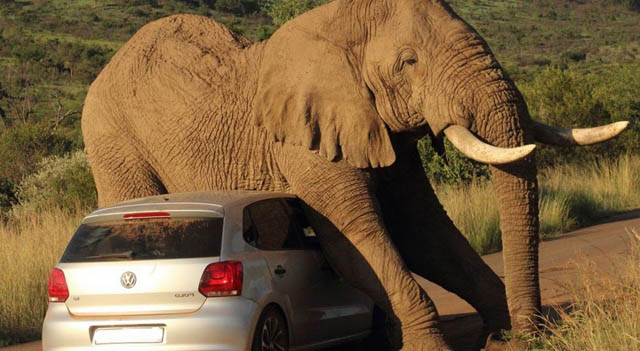
The image size is (640, 351). In order to click on door handle in this screenshot , I will do `click(282, 271)`.